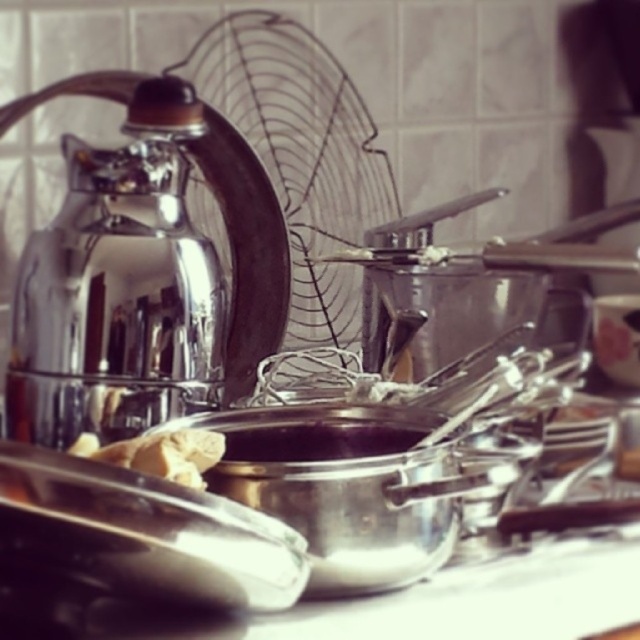
Question: Among these objects, which one is farthest from the camera?

Choices:
 (A) shiny metallic kettle at left
 (B) white crumbly dough at center

Answer: (A)

Question: Does shiny metallic kettle at left appear on the left side of white crumbly dough at center?

Choices:
 (A) no
 (B) yes

Answer: (B)

Question: Can you confirm if shiny metallic kettle at left is wider than white crumbly dough at center?

Choices:
 (A) yes
 (B) no

Answer: (A)

Question: Considering the relative positions of shiny metallic kettle at left and white crumbly dough at center in the image provided, where is shiny metallic kettle at left located with respect to white crumbly dough at center?

Choices:
 (A) left
 (B) right

Answer: (A)

Question: Which point is farther to the camera?

Choices:
 (A) (188, 458)
 (B) (230, 340)

Answer: (B)

Question: Which point is farther to the camera?

Choices:
 (A) (141, 324)
 (B) (186, 445)

Answer: (A)